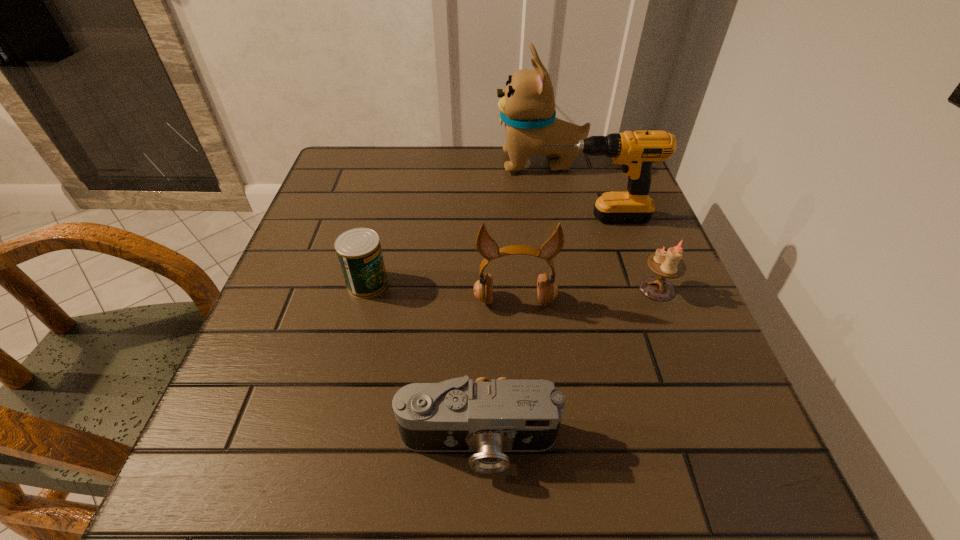
Identify the location of the tallest object. This screenshot has width=960, height=540. tap(527, 106).

You are a GUI agent. You are given a task and a screenshot of the screen. Output one action in this format:
    pyautogui.click(x=<x>, y=<y>)
    Task: Click on the puppy
    The height and width of the screenshot is (540, 960).
    Given the screenshot: What is the action you would take?
    pyautogui.click(x=527, y=106)

Where is `drill`? This screenshot has height=540, width=960. drill is located at coordinates (636, 152).

Identify the location of earphone. Image resolution: width=960 pixels, height=540 pixels. (547, 289).

Locate an element on the screen. The image size is (960, 540). candle holder is located at coordinates (666, 264).

Locate an element on the screen. The width and height of the screenshot is (960, 540). can is located at coordinates (359, 252).

This screenshot has height=540, width=960. I want to click on camera, so click(x=510, y=415).

At what (x,y) coordinates should I click in order to perform the action: click on vacant point located on the face of the puppy. Please return your answer as a coordinate pair (x, y). Looking at the image, I should click on (452, 163).

Identify the location of free space located on the face of the puppy. This screenshot has width=960, height=540. (379, 163).

In order to click on free space located 0.400m on the face of the puppy in this screenshot , I will do `click(350, 163)`.